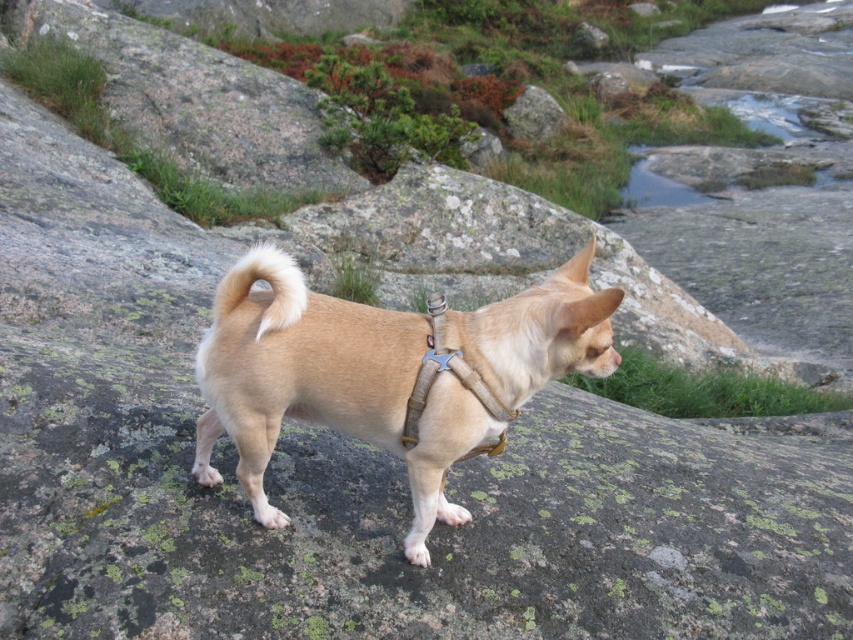
You are a photographer trying to capture the tan fabric dog at center and the fuzzy beige tail at center in a single shot. Based on their sizes, which one would you need to frame more carefully to ensure it doesn not get lost in the background?

The fuzzy beige tail at center is narrower than the tan fabric dog at center, so you should frame it more carefully to prevent it from being overshadowed by the background.